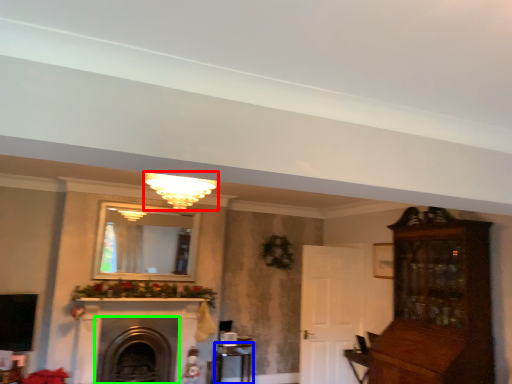
Question: Estimate the real-world distances between objects in this image. Which object is closer to light fixture (highlighted by a red box), table (highlighted by a blue box) or fireplace (highlighted by a green box)?

Choices:
 (A) table
 (B) fireplace

Answer: (B)